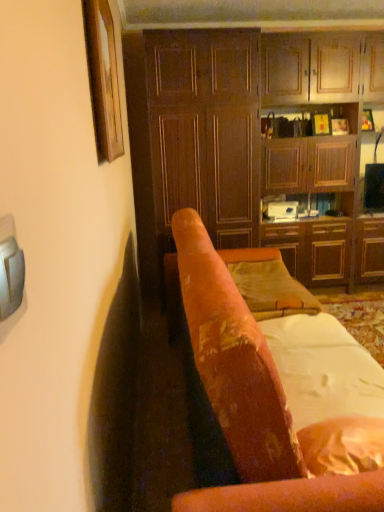
What do you see at coordinates (268, 284) in the screenshot?
I see `velvet orange pillow at center` at bounding box center [268, 284].

Describe the element at coordinates (323, 369) in the screenshot. I see `white soft fabric at center` at that location.

At what (x,y) coordinates should I click in order to perform the action: click on wooden cabinet at center. Please return your answer as a coordinate pair (x, y). Looking at the image, I should click on (206, 129).

Image resolution: width=384 pixels, height=512 pixels. What are the coordinates of `velvet orange pillow at center` in the screenshot? It's located at (268, 284).

Is velvet-like orange chair at center wider than velvet orange pillow at center?

Correct, the width of velvet-like orange chair at center exceeds that of velvet orange pillow at center.

Who is shorter, velvet-like orange chair at center or velvet orange pillow at center?

Standing shorter between the two is velvet orange pillow at center.

From the image's perspective, is velvet-like orange chair at center over velvet orange pillow at center?

Incorrect, from the image's perspective, velvet-like orange chair at center is lower than velvet orange pillow at center.

Which of these two, wooden cabinet at center or wooden picture frame at upper left, stands taller?

Standing taller between the two is wooden cabinet at center.

From the image's perspective, is wooden cabinet at center above wooden picture frame at upper left?

Actually, wooden cabinet at center appears below wooden picture frame at upper left in the image.

Considering the sizes of objects wooden cabinet at center and wooden picture frame at upper left in the image provided, who is thinner, wooden cabinet at center or wooden picture frame at upper left?

wooden picture frame at upper left is thinner.

Is wooden cabinet at center not close to wooden picture frame at upper left?

Yes, wooden cabinet at center and wooden picture frame at upper left are located far from each other.

Is wooden cabinet at right facing towards velvet-like orange chair at center?

Yes, wooden cabinet at right is aimed at velvet-like orange chair at center.

Based on the photo, how many degrees apart are the facing directions of wooden cabinet at right and velvet-like orange chair at center?

90 degrees.

Is wooden cabinet at right in front of or behind velvet-like orange chair at center in the image?

Visually, wooden cabinet at right is located behind velvet-like orange chair at center.

Consider the image. Who is taller, wooden cabinet at right or velvet-like orange chair at center?

Standing taller between the two is wooden cabinet at right.

Who is smaller, wooden cabinet at center or white soft fabric at center?

With smaller size is white soft fabric at center.

Considering the positions of points (182, 47) and (300, 314), is point (182, 47) closer to camera compared to point (300, 314)?

No.

The height and width of the screenshot is (512, 384). Identify the location of sheet located in front of the wooden cabinet at center. (323, 369).

Is velvet orange pillow at center in front of or behind velvet-like orange chair at center in the image?

Visually, velvet orange pillow at center is located behind velvet-like orange chair at center.

From the image's perspective, which is below, velvet orange pillow at center or velvet-like orange chair at center?

velvet-like orange chair at center is shown below in the image.

Does velvet orange pillow at center appear on the right side of velvet-like orange chair at center?

Indeed, velvet orange pillow at center is positioned on the right side of velvet-like orange chair at center.

Is velvet orange pillow at center situated inside velvet-like orange chair at center or outside?

velvet orange pillow at center can be found inside velvet-like orange chair at center.

Considering the positions of objects velvet-like orange chair at center and wooden cabinet at center in the image provided, who is more to the left, velvet-like orange chair at center or wooden cabinet at center?

Positioned to the left is wooden cabinet at center.

Which of these two, velvet-like orange chair at center or wooden cabinet at center, is bigger?

velvet-like orange chair at center.

Which object is further away from the camera taking this photo, velvet-like orange chair at center or wooden cabinet at center?

wooden cabinet at center is further away from the camera.

Could you tell me if wooden picture frame at upper left is facing wooden cabinet at right?

No, wooden picture frame at upper left is not turned towards wooden cabinet at right.

From a real-world perspective, between wooden picture frame at upper left and wooden cabinet at right, who is vertically higher?

wooden picture frame at upper left is physically above.

Which is less distant, (x=92, y=55) or (x=352, y=180)?

The point (x=92, y=55) is in front.

Find the location of a particular element. chair in front of the velvet orange pillow at center is located at coordinates (279, 396).

Identify the location of picture frame above the wooden cabinet at center (from the image's perspective). The width and height of the screenshot is (384, 512). (103, 79).

From the image, which object appears to be nearer to wooden picture frame at upper left, white soft fabric at center or wooden cabinet at right?

The object closer to wooden picture frame at upper left is white soft fabric at center.

In the scene shown: From the image, which object appears to be nearer to wooden cabinet at right, velvet-like orange chair at center or wooden cabinet at center?

wooden cabinet at center is positioned closer to the anchor wooden cabinet at right.

From the image, which object appears to be nearer to wooden picture frame at upper left, white soft fabric at center or velvet-like orange chair at center?

velvet-like orange chair at center is closer to wooden picture frame at upper left.

Considering their positions, is velvet-like orange chair at center positioned further to velvet orange pillow at center than wooden picture frame at upper left?

wooden picture frame at upper left.

Considering their positions, is velvet orange pillow at center positioned closer to wooden cabinet at center than wooden cabinet at right?

wooden cabinet at right is positioned closer to the anchor wooden cabinet at center.

Looking at the image, which one is located closer to white soft fabric at center, velvet orange pillow at center or wooden picture frame at upper left?

velvet orange pillow at center is closer to white soft fabric at center.

When comparing their distances from white soft fabric at center, does wooden cabinet at right or velvet orange pillow at center seem closer?

velvet orange pillow at center.

Which object lies further to the anchor point wooden cabinet at right, velvet-like orange chair at center or wooden picture frame at upper left?

wooden picture frame at upper left is further to wooden cabinet at right.

This screenshot has height=512, width=384. Find the location of `pillow situated between wooden cabinet at center and wooden cabinet at right from left to right`. pillow situated between wooden cabinet at center and wooden cabinet at right from left to right is located at coordinates (268, 284).

Where is `picture frame positioned between velvet-like orange chair at center and wooden cabinet at right from near to far`? This screenshot has width=384, height=512. picture frame positioned between velvet-like orange chair at center and wooden cabinet at right from near to far is located at coordinates (103, 79).

This screenshot has height=512, width=384. What are the coordinates of `pillow positioned between velvet-like orange chair at center and wooden cabinet at center from near to far` in the screenshot? It's located at [268, 284].

Locate an element on the screen. The image size is (384, 512). picture frame between velvet-like orange chair at center and velvet orange pillow at center from front to back is located at coordinates (103, 79).